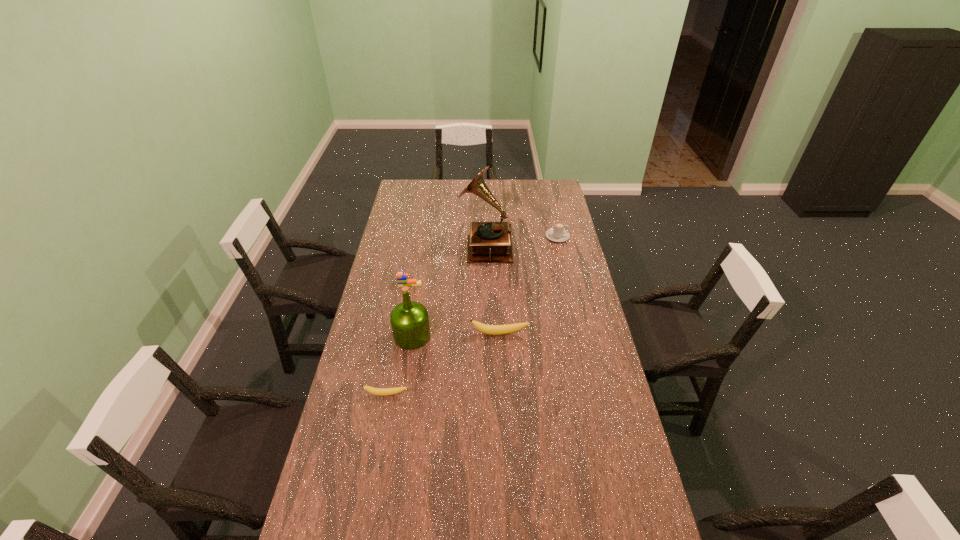
Identify the location of blank space located on the upward curve of the farther banana. This screenshot has height=540, width=960. (502, 395).

Identify the location of vacant region located on the horn of the record player. The image size is (960, 540). (418, 246).

In order to click on vacant space located on the horn of the record player in this screenshot , I will do coord(393,246).

Find the location of `free point located on the horn of the record player`. free point located on the horn of the record player is located at coordinates (420, 246).

Find the location of a particular element. This screenshot has height=540, width=960. vacant space located on the front of the second shortest object is located at coordinates (400, 336).

The width and height of the screenshot is (960, 540). I want to click on vacant space located on the right of the second tallest object, so click(x=525, y=336).

You are a GUI agent. You are given a task and a screenshot of the screen. Output one action in this format:
    pyautogui.click(x=<x>, y=<y>)
    Task: Click on the banana located in the left edge section of the desktop
    This screenshot has width=960, height=540.
    Given the screenshot: What is the action you would take?
    pyautogui.click(x=375, y=391)

Locate an element on the screen. Lego that is at the left edge is located at coordinates (402, 278).

Locate an element on the screen. This screenshot has width=960, height=540. olive oil at the left edge is located at coordinates (409, 320).

The image size is (960, 540). I want to click on object that is at the right edge, so click(558, 234).